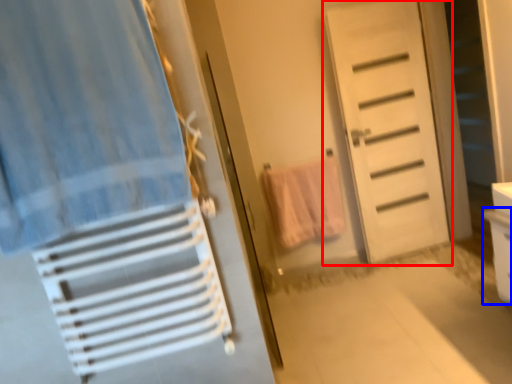
Question: Among these objects, which one is farthest to the camera, door (highlighted by a red box) or drawer (highlighted by a blue box)?

Choices:
 (A) door
 (B) drawer

Answer: (A)